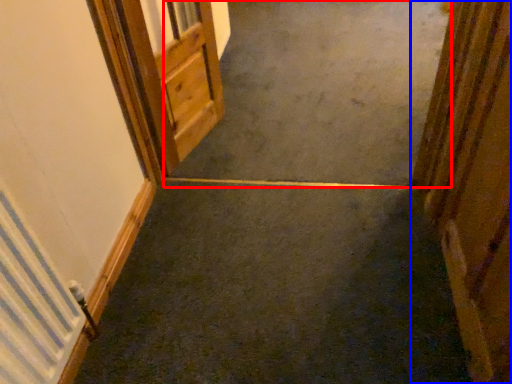
Question: Which object is further to the camera taking this photo, concrete (highlighted by a red box) or door (highlighted by a blue box)?

Choices:
 (A) concrete
 (B) door

Answer: (A)